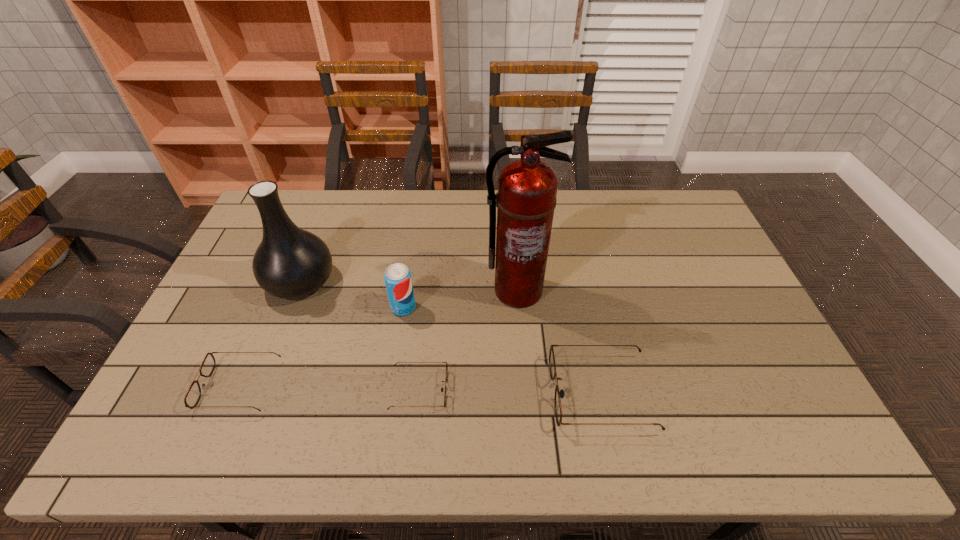
Where is `free spot located 0.360m on the front-facing side of the second sunglasses from right to left`? free spot located 0.360m on the front-facing side of the second sunglasses from right to left is located at coordinates (588, 389).

Locate an element on the screen. This screenshot has width=960, height=540. vacant point located 0.080m on the front-facing side of the rightmost sunglasses is located at coordinates (520, 393).

You are a GUI agent. You are given a task and a screenshot of the screen. Output one action in this format:
    pyautogui.click(x=<x>, y=<y>)
    Task: Click on the vacant space situated on the front-facing side of the rightmost sunglasses
    
    Given the screenshot: What is the action you would take?
    pyautogui.click(x=397, y=393)

Where is `vacant space located 0.380m on the front-facing side of the rightmost sunglasses`? The image size is (960, 540). vacant space located 0.380m on the front-facing side of the rightmost sunglasses is located at coordinates (401, 393).

Locate an element on the screen. Image resolution: width=960 pixels, height=540 pixels. vacant space located 0.220m on the left of the soda can is located at coordinates (317, 307).

Where is `vacant space located on the left of the vase`? vacant space located on the left of the vase is located at coordinates (227, 282).

At what (x,y) coordinates should I click in order to perform the action: click on vacant space located 0.180m on the side of the fire extinguisher with the handle and hose. Please return your answer as a coordinate pair (x, y). The height and width of the screenshot is (540, 960). Looking at the image, I should click on (523, 361).

At what (x,y) coordinates should I click in order to perform the action: click on sunglasses situated at the left edge. Please return your answer as a coordinate pair (x, y). The height and width of the screenshot is (540, 960). Looking at the image, I should click on (192, 397).

This screenshot has height=540, width=960. Identify the location of vase that is at the left edge. (289, 263).

Where is `object that is at the near left corner`? This screenshot has height=540, width=960. object that is at the near left corner is located at coordinates (192, 397).